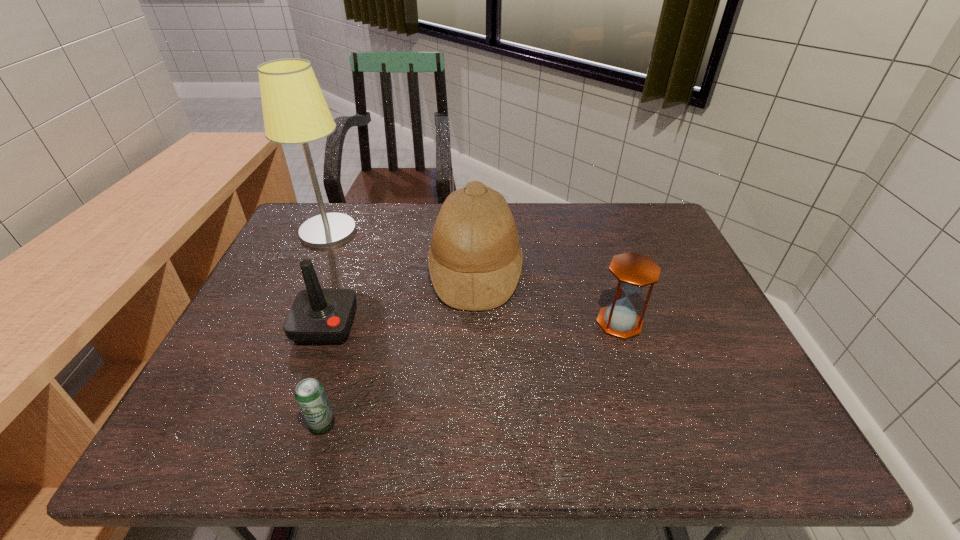
This screenshot has height=540, width=960. I want to click on vacant space at the left edge of the desktop, so click(x=273, y=276).

I want to click on vacant space at the right edge of the desktop, so pyautogui.click(x=756, y=413).

At what (x,y) coordinates should I click in order to perform the action: click on free space at the far right corner of the desktop. Please return your answer as a coordinate pair (x, y). Looking at the image, I should click on (661, 231).

Find the location of a particular element. blank region between the nearest object and the joystick is located at coordinates (324, 375).

I want to click on empty space between the hat and the rightmost object, so click(547, 296).

Find the location of a particular element. The image size is (960, 540). free area in between the joystick and the table lamp is located at coordinates click(327, 279).

Where is `free spot between the hat and the tallest object`? The image size is (960, 540). free spot between the hat and the tallest object is located at coordinates (402, 251).

Find the location of a particular element. Image resolution: width=960 pixels, height=540 pixels. free space between the table lamp and the joystick is located at coordinates (327, 279).

Image resolution: width=960 pixels, height=540 pixels. I want to click on vacant space in between the fourth shortest object and the hourglass, so [x=547, y=296].

Locate an element on the screen. This screenshot has height=540, width=960. free spot between the joystick and the rightmost object is located at coordinates (472, 324).